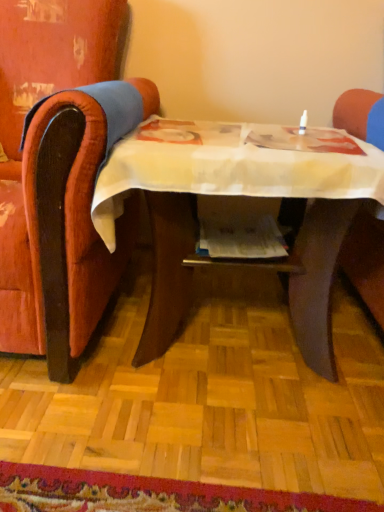
Question: Is printed paper magazine at center oriented away from wooden table at center?

Choices:
 (A) yes
 (B) no

Answer: (A)

Question: Is wooden table at center completely or partially inside printed paper magazine at center?

Choices:
 (A) yes
 (B) no

Answer: (B)

Question: Considering the relative sizes of printed paper magazine at center and wooden table at center in the image provided, is printed paper magazine at center taller than wooden table at center?

Choices:
 (A) no
 (B) yes

Answer: (A)

Question: Is printed paper magazine at center wider than wooden table at center?

Choices:
 (A) yes
 (B) no

Answer: (B)

Question: Is printed paper magazine at center positioned behind wooden table at center?

Choices:
 (A) no
 (B) yes

Answer: (B)

Question: From the image's perspective, is printed paper magazine at center above or below wooden table at center?

Choices:
 (A) below
 (B) above

Answer: (B)

Question: In the image, is printed paper magazine at center positioned in front of or behind wooden table at center?

Choices:
 (A) front
 (B) behind

Answer: (B)

Question: Based on their sizes in the image, would you say printed paper magazine at center is bigger or smaller than wooden table at center?

Choices:
 (A) big
 (B) small

Answer: (B)

Question: From a real-world perspective, is printed paper magazine at center above or below wooden table at center?

Choices:
 (A) below
 (B) above

Answer: (B)

Question: Based on their positions, is velvet-like red armchair at left located to the left or right of wooden table at center?

Choices:
 (A) left
 (B) right

Answer: (A)

Question: Considering their positions, is velvet-like red armchair at left located in front of or behind wooden table at center?

Choices:
 (A) behind
 (B) front

Answer: (B)

Question: From the image's perspective, relative to wooden table at center, is velvet-like red armchair at left above or below?

Choices:
 (A) below
 (B) above

Answer: (B)

Question: Is point (21, 219) closer or farther from the camera than point (322, 248)?

Choices:
 (A) closer
 (B) farther

Answer: (A)

Question: From a real-world perspective, is printed paper magazine at center physically located above or below velvet-like red armchair at left?

Choices:
 (A) above
 (B) below

Answer: (B)

Question: In the image, is printed paper magazine at center positioned in front of or behind velvet-like red armchair at left?

Choices:
 (A) behind
 (B) front

Answer: (A)